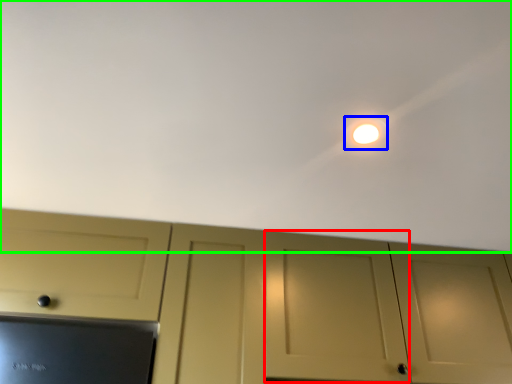
Question: Which is nearer to the door (highlighted by a red box)? light (highlighted by a blue box) or backdrop (highlighted by a green box).

Choices:
 (A) light
 (B) backdrop

Answer: (B)